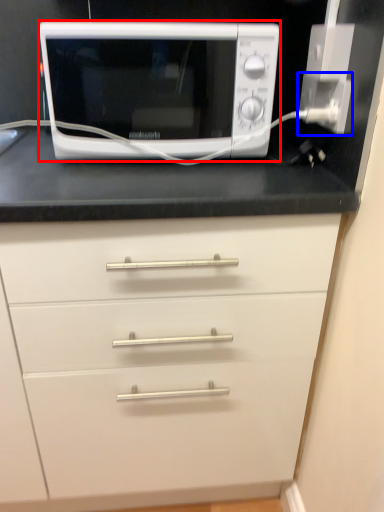
Question: Which object is further to the camera taking this photo, microwave oven (highlighted by a red box) or electric outlet (highlighted by a blue box)?

Choices:
 (A) microwave oven
 (B) electric outlet

Answer: (B)